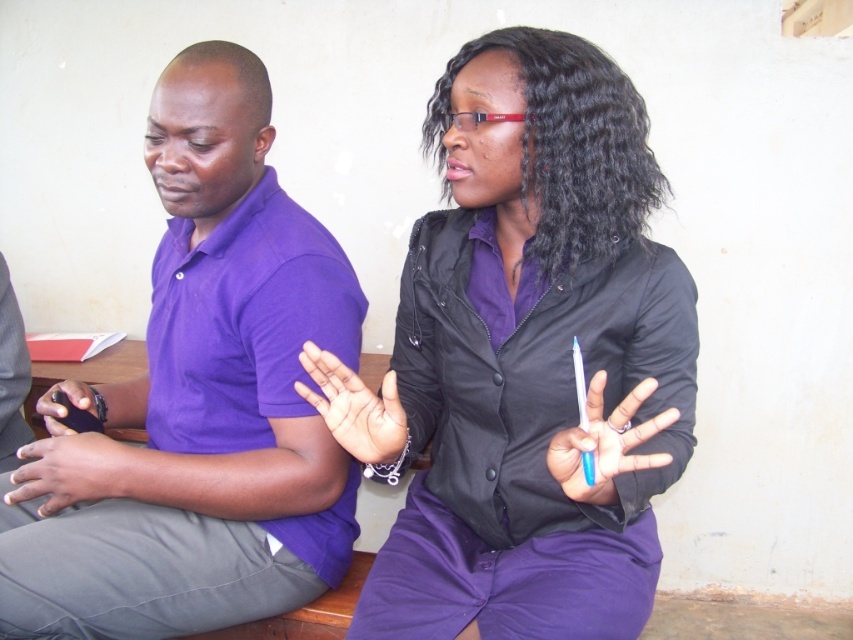
You are a fashion designer observing two shirts in the image. The matte black shirt at center and the purple matte shirt at left. Which shirt has a narrower width?

The matte black shirt at center is thinner than the purple matte shirt at left, so the matte black shirt at center has a narrower width.

You are a photographer trying to capture a closeup of the smooth skin hand at center and the matte black phone at left. Based on their relative heights, which object should you focus on first to ensure both are in frame?

The smooth skin hand at center is taller than the matte black phone at left, so you should focus on the smooth skin hand at center first to ensure both are in frame.